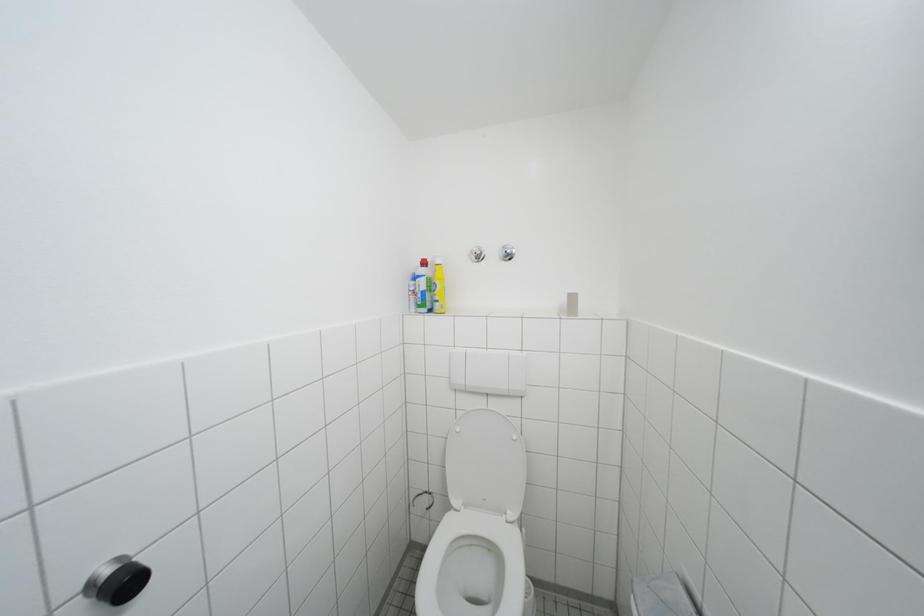
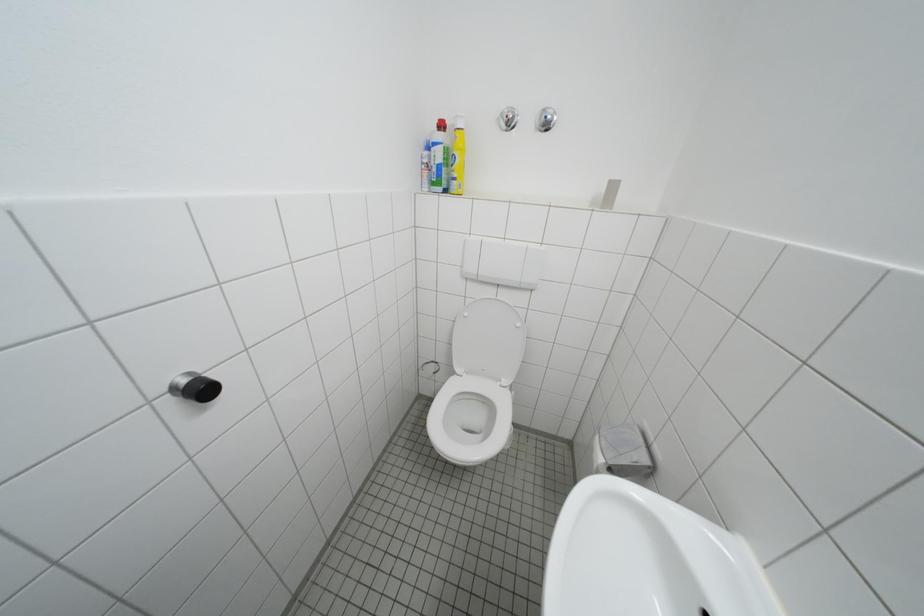
Which direction would the cameraman need to move to produce the second image?

The movement direction of the cameraman is left, forward.